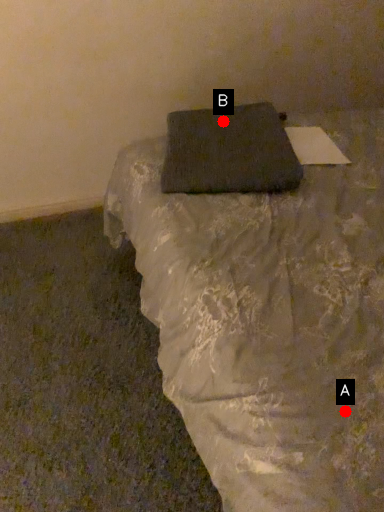
Question: Two points are circled on the image, labeled by A and B beside each circle. Which of the following is the closest to the observer?

Choices:
 (A) A is closer
 (B) B is closer

Answer: (A)